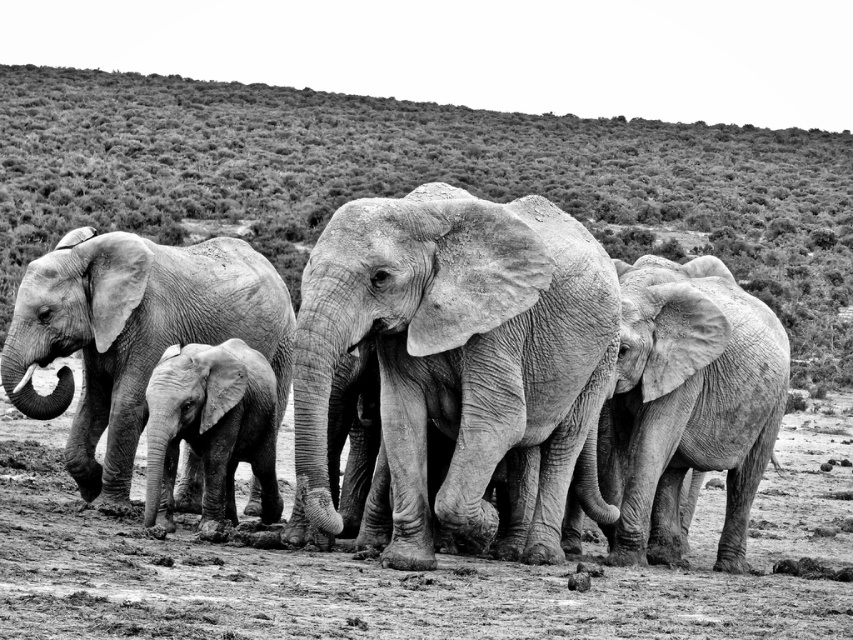
From the picture: You are observing a herd of elephants in a savanna. There are gray textured elephants at center and a gray textured elephant at right. Which group is positioned more to the left side of the image?

The gray textured elephants at center are positioned more to the left side of the image compared to the gray textured elephant at right.

Consider the image. You are a wildlife photographer trying to capture a photo of the gray textured elephants at center and the gray textured elephant at right. Based on their positions, which elephant would appear closer to the camera in the photograph?

The gray textured elephants at center is shorter than the gray textured elephant at right. Since the elephant at the center is shorter, it might be positioned farther back, making the elephant at the right appear closer to the camera in the photograph.

Consider the image. You are standing in the savanna looking at the elephants. There are two points marked on the image. The first point is at coordinate point (466, 209) and the second is at point (84, 460). Which point is closer to you?

Point (466, 209) is in front of point (84, 460), so it is closer to you.